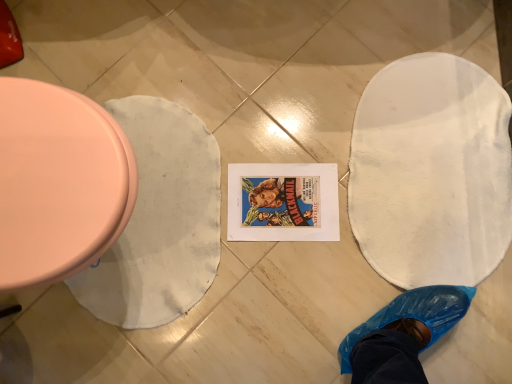
This screenshot has width=512, height=384. In order to click on empty space that is to the right of white fabric blanket at left in this screenshot , I will do `click(308, 197)`.